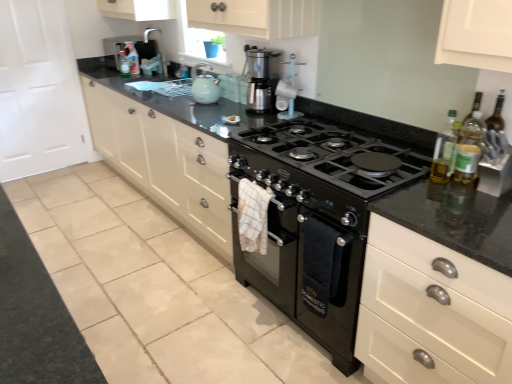
Question: Is matte white cabinets at center shorter than translucent plastic bottle at upper center, the third bottle positioned from the front?

Choices:
 (A) no
 (B) yes

Answer: (A)

Question: Does matte white cabinets at center have a larger size compared to translucent plastic bottle at upper center, the third bottle in the left-to-right sequence?

Choices:
 (A) no
 (B) yes

Answer: (B)

Question: Is matte white cabinets at center positioned before translucent plastic bottle at upper center, which is the third bottle from top to bottom?

Choices:
 (A) yes
 (B) no

Answer: (A)

Question: Is matte white cabinets at center to the right of translucent plastic bottle at upper center, positioned as the 3th bottle in bottom-to-top order, from the viewer's perspective?

Choices:
 (A) yes
 (B) no

Answer: (B)

Question: From the image's perspective, is matte white cabinets at center located beneath translucent plastic bottle at upper center, the 3th bottle viewed from the back?

Choices:
 (A) yes
 (B) no

Answer: (A)

Question: Is translucent plastic bottle at upper center, arranged as the first bottle when viewed from the top, bigger or smaller than translucent plastic bottle at upper center, the third bottle in the left-to-right sequence?

Choices:
 (A) big
 (B) small

Answer: (A)

Question: In terms of width, does translucent plastic bottle at upper center, which ranks as the 5th bottle in front-to-back order, look wider or thinner when compared to translucent plastic bottle at upper center, the third bottle positioned from the front?

Choices:
 (A) thin
 (B) wide

Answer: (B)

Question: Choose the correct answer: Is translucent plastic bottle at upper center, arranged as the 1th bottle when viewed from the back, inside translucent plastic bottle at upper center, which is the third bottle from top to bottom, or outside it?

Choices:
 (A) inside
 (B) outside

Answer: (B)

Question: From the image's perspective, is translucent plastic bottle at upper center, acting as the second bottle starting from the left, located above or below translucent plastic bottle at upper center, the third bottle in the left-to-right sequence?

Choices:
 (A) above
 (B) below

Answer: (A)

Question: From the image's perspective, is matte ceramic kettle at upper center above or below translucent plastic bottle at right, acting as the 2th bottle starting from the front?

Choices:
 (A) below
 (B) above

Answer: (B)

Question: From a real-world perspective, is matte ceramic kettle at upper center above or below translucent plastic bottle at right, which appears as the 2th bottle when ordered from the bottom?

Choices:
 (A) above
 (B) below

Answer: (B)

Question: Is matte ceramic kettle at upper center in front of or behind translucent plastic bottle at right, acting as the 4th bottle starting from the top, in the image?

Choices:
 (A) front
 (B) behind

Answer: (B)

Question: Looking at the image, does matte ceramic kettle at upper center seem bigger or smaller compared to translucent plastic bottle at right, acting as the second bottle starting from the right?

Choices:
 (A) big
 (B) small

Answer: (A)

Question: From a real-world perspective, is translucent plastic bottle at upper center, which ranks as the 2th bottle in back-to-front order, physically located above or below translucent plastic bottle at upper center, arranged as the first bottle when viewed from the top?

Choices:
 (A) above
 (B) below

Answer: (B)

Question: Is translucent plastic bottle at upper center, which ranks as the 2th bottle in back-to-front order, taller or shorter than translucent plastic bottle at upper center, the fifth bottle when ordered from bottom to top?

Choices:
 (A) short
 (B) tall

Answer: (A)